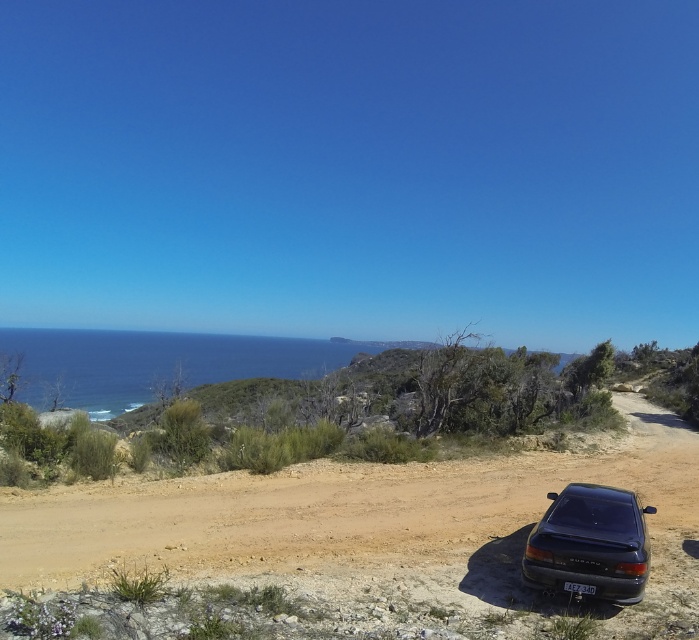
Who is more forward, (526, 545) or (577, 593)?

Positioned in front is point (577, 593).

Does glossy black car at lower right have a greater width compared to black plastic license plate at lower center?

Yes.

Is point (612, 508) behind point (579, 593)?

Yes, point (612, 508) is behind point (579, 593).

The height and width of the screenshot is (640, 699). In order to click on glossy black car at lower right in this screenshot , I will do pos(590,541).

Is brown dirt track at center thinner than black plastic license plate at lower center?

In fact, brown dirt track at center might be wider than black plastic license plate at lower center.

Does point (48, 570) lie in front of point (583, 586)?

That is False.

This screenshot has width=699, height=640. Find the location of `brown dirt track at center`. brown dirt track at center is located at coordinates (333, 508).

Is brown dirt track at center positioned before glossy black car at lower right?

That is True.

Which is in front, point (147, 516) or point (590, 547)?

Point (590, 547) is more forward.

Who is more forward, [691,440] or [637,557]?

Point [637,557] is more forward.

You are a GUI agent. You are given a task and a screenshot of the screen. Output one action in this format:
    pyautogui.click(x=<x>, y=<y>)
    Task: Click on the brown dirt track at center
    
    Given the screenshot: What is the action you would take?
    pyautogui.click(x=333, y=508)